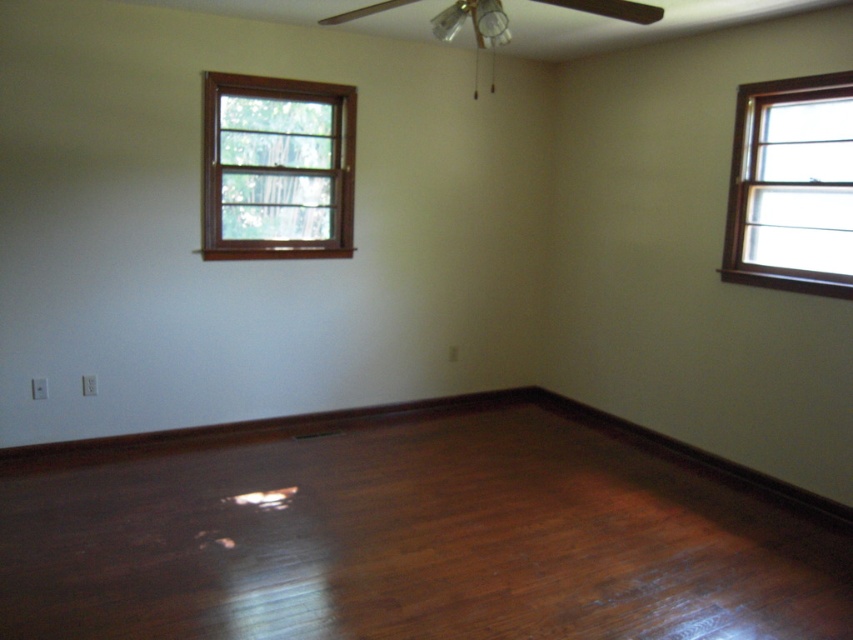
Question: Based on their relative distances, which object is nearer to the wooden window at upper right?

Choices:
 (A) shiny brown hardwood floor at center
 (B) brown wooden window at upper left

Answer: (A)

Question: From the image, what is the correct spatial relationship of shiny brown hardwood floor at center in relation to brown wooden window at upper left?

Choices:
 (A) below
 (B) above

Answer: (A)

Question: Does brown wooden window at upper left have a larger size compared to wooden window at upper right?

Choices:
 (A) no
 (B) yes

Answer: (B)

Question: Which of the following is the closest to the observer?

Choices:
 (A) brown wooden window at upper left
 (B) shiny brown hardwood floor at center

Answer: (B)

Question: Which object is the closest to the brown wooden window at upper left?

Choices:
 (A) wooden window at upper right
 (B) shiny brown hardwood floor at center

Answer: (B)

Question: Observing the image, what is the correct spatial positioning of shiny brown hardwood floor at center in reference to brown wooden window at upper left?

Choices:
 (A) left
 (B) right

Answer: (B)